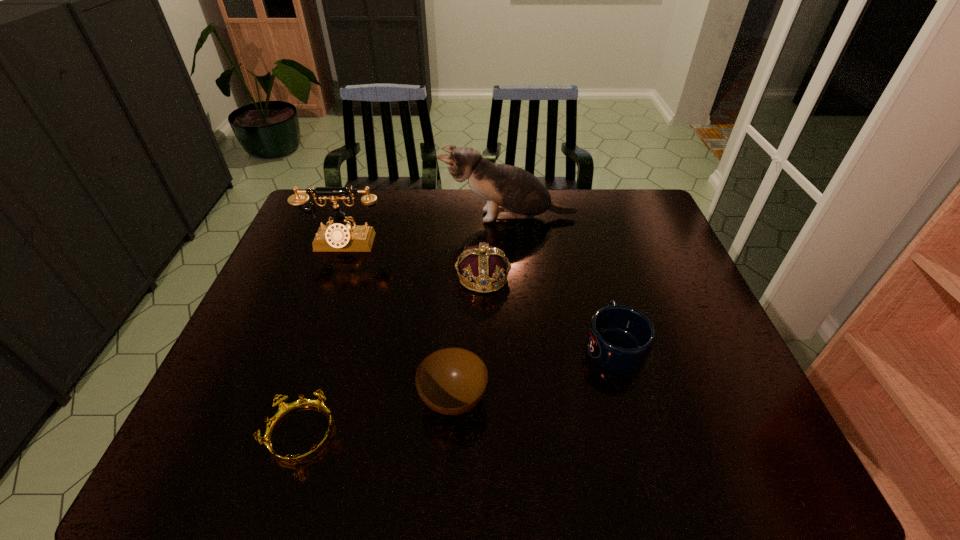
I want to click on free space that satisfies the following two spatial constraints: 1. on the dial of the bowl; 2. on the left side of the fifth nearest object, so click(287, 399).